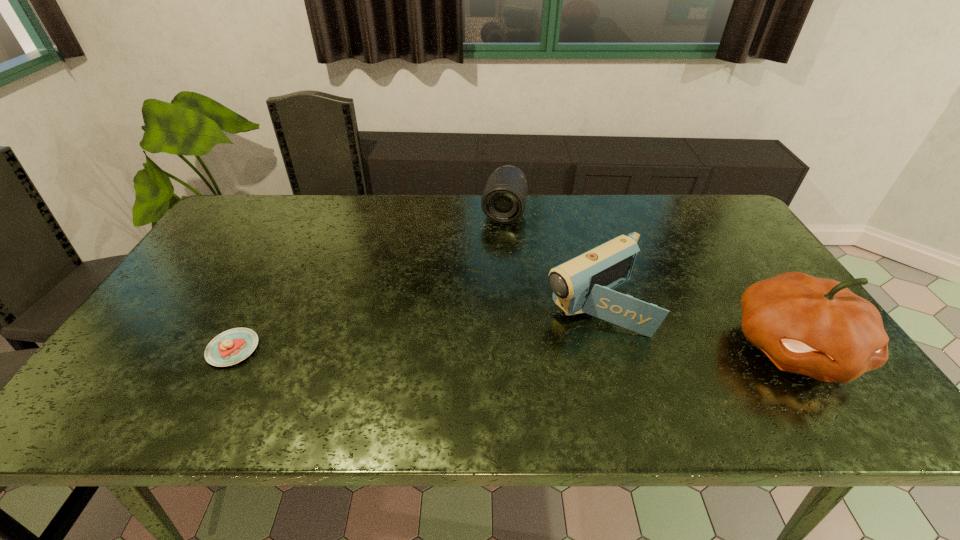
Where is `vacant spot on the desktop that is between the shortest object and the pumpkin and is positioned on the side of the third object from left to right with the flip-out screen`? This screenshot has width=960, height=540. vacant spot on the desktop that is between the shortest object and the pumpkin and is positioned on the side of the third object from left to right with the flip-out screen is located at coordinates (513, 348).

Locate an element on the screen. This screenshot has height=540, width=960. vacant spot on the desktop that is between the leftmost object and the rightmost object and is positioned on the surface of the farthest object is located at coordinates tap(471, 348).